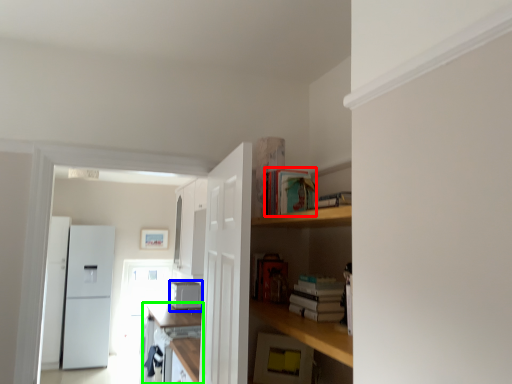
Question: Which object is the closest to the book (highlighted by a red box)? Choose among these: appliance (highlighted by a blue box) or cabinetry (highlighted by a green box).

Choices:
 (A) appliance
 (B) cabinetry

Answer: (B)